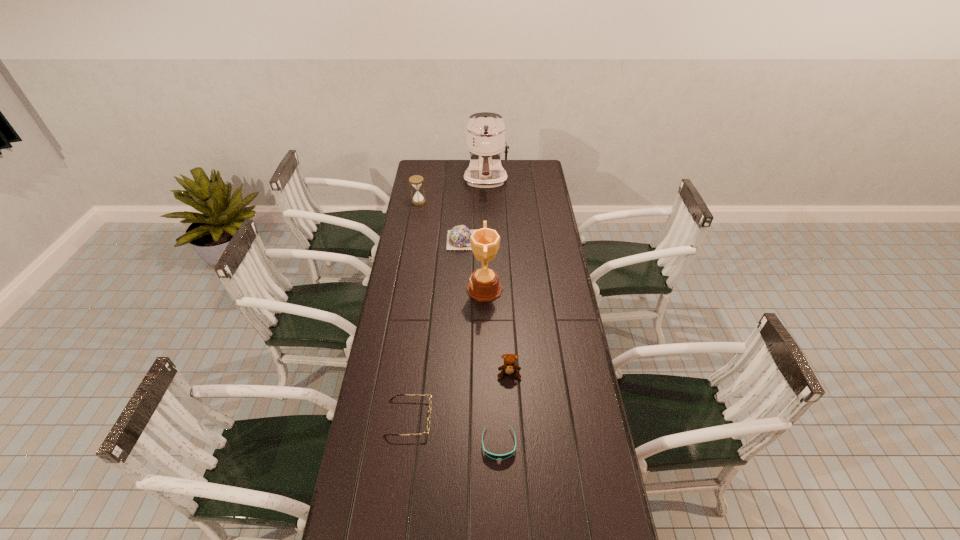
At what (x,y) coordinates should I click in order to perform the action: click on free space between the fifth farthest object and the second tallest object. Please return your answer as a coordinate pair (x, y). The width and height of the screenshot is (960, 540). Looking at the image, I should click on (497, 332).

Identify the location of vacant area that lies between the sunglasses and the fourth nearest object. (492, 367).

This screenshot has width=960, height=540. Find the location of `free space between the second shortest object and the coffee maker`. free space between the second shortest object and the coffee maker is located at coordinates 447,300.

This screenshot has width=960, height=540. Find the location of `empty space between the second tallest object and the third nearest object`. empty space between the second tallest object and the third nearest object is located at coordinates (497, 332).

Select which object appears as the third closest to the sixth shortest object. Please provide its 2D coordinates. Your answer should be formatted as a tuple, i.e. [(x, y)], where the tuple contains the x and y coordinates of a point satisfying the conditions above.

[(430, 404)]

Point out which object is positioned as the nearest to the sixth tallest object. Please provide its 2D coordinates. Your answer should be formatted as a tuple, i.e. [(x, y)], where the tuple contains the x and y coordinates of a point satisfying the conditions above.

[(494, 456)]

The height and width of the screenshot is (540, 960). I want to click on blank space that satisfies the following two spatial constraints: 1. on the front-facing side of the coffee maker; 2. on the front-facing side of the award, so click(x=488, y=289).

What are the coordinates of `vacant area that satisfies the following two spatial constraints: 1. on the front-facing side of the fourth shortest object; 2. on the lenses of the spectacles` in the screenshot? It's located at tap(512, 418).

Where is `free space that satisfies the following two spatial constraints: 1. on the front-facing side of the third nearest object; 2. on the lenses of the second shortest object`? free space that satisfies the following two spatial constraints: 1. on the front-facing side of the third nearest object; 2. on the lenses of the second shortest object is located at coordinates (512, 418).